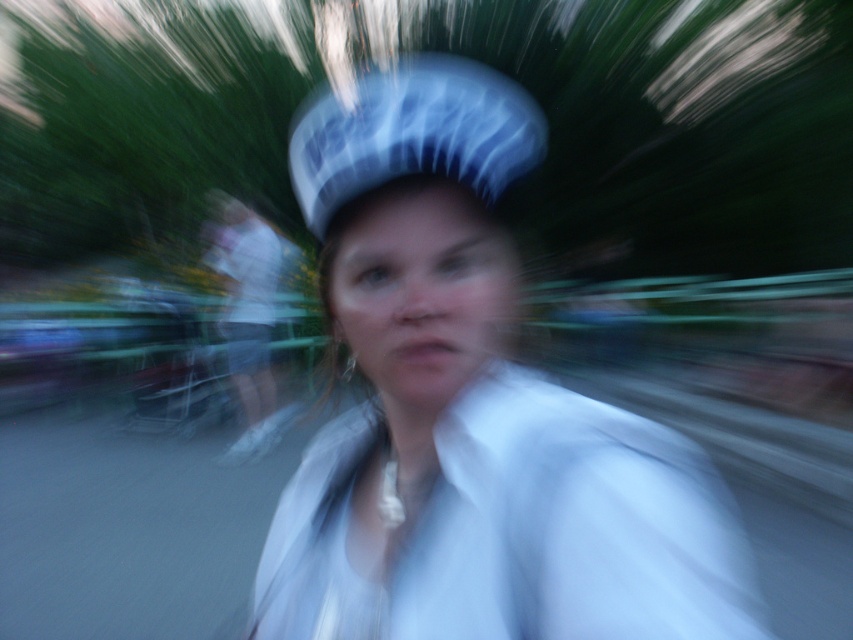
Is white silky dress shirt at center above white fabric shirt at center?

No.

Is point (419, 516) behind point (253, 236)?

No, (419, 516) is closer to viewer.

Identify the location of white silky dress shirt at center. This screenshot has width=853, height=640. (515, 531).

Consider the image. Is white fabric at center positioned behind white silky dress shirt at center?

Yes.

Between white fabric at center and white silky dress shirt at center, which one is positioned lower?

Positioned lower is white silky dress shirt at center.

Is point (567, 531) positioned after point (343, 461)?

No, it is not.

Image resolution: width=853 pixels, height=640 pixels. I want to click on white fabric at center, so click(471, 412).

Is white striped bicycle helmet at center to the right of white fabric shirt at center from the viewer's perspective?

Yes, white striped bicycle helmet at center is to the right of white fabric shirt at center.

Measure the distance between point (351, 160) and camera.

Point (351, 160) is 24.02 inches away from camera.

Is point (396, 109) closer to viewer compared to point (225, 195)?

Yes, point (396, 109) is in front of point (225, 195).

This screenshot has height=640, width=853. I want to click on white striped bicycle helmet at center, so click(412, 132).